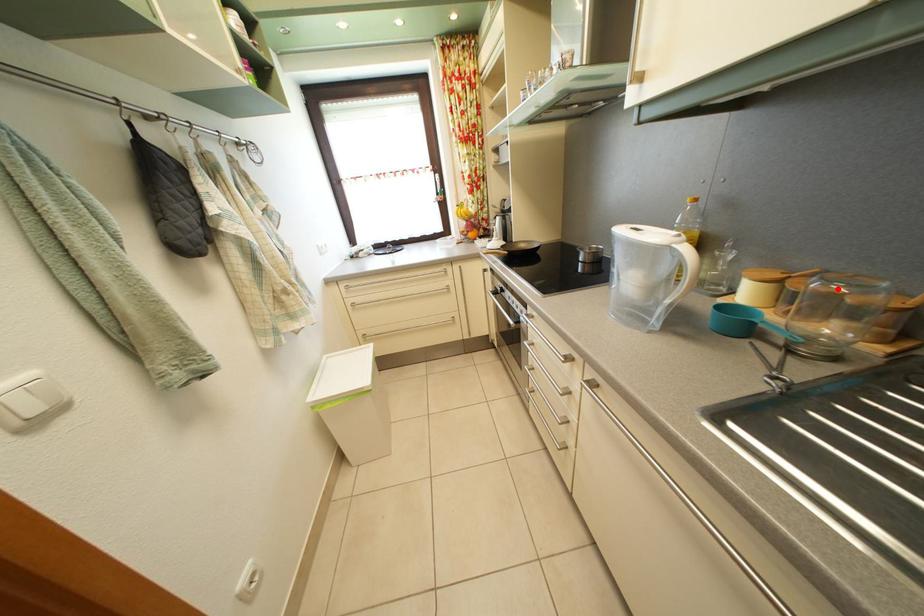
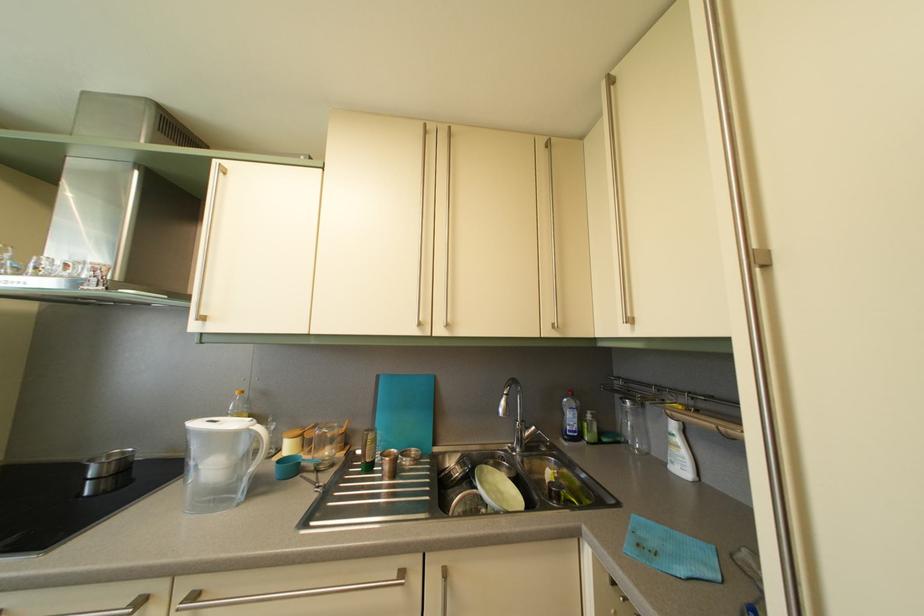
In the second image, find the point that corresponds to the highlighted location in the first image.

(330, 436)